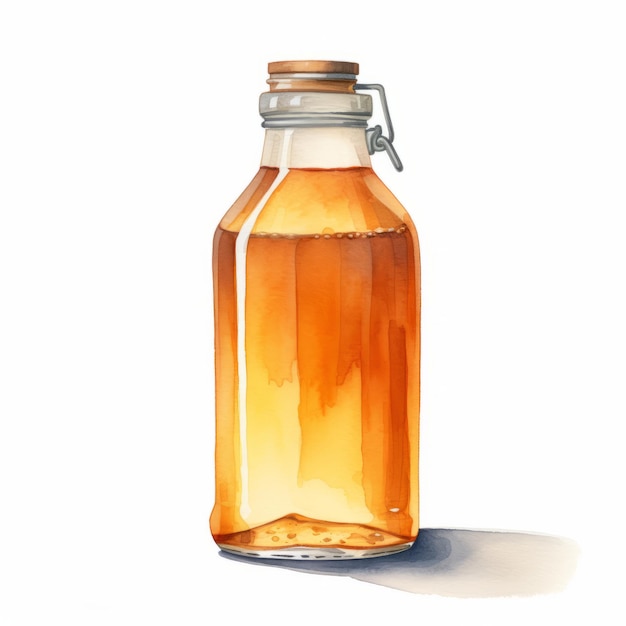
At what (x,y) coordinates should I click in order to perform the action: click on glass. Please return your answer as a coordinate pair (x, y). Looking at the image, I should click on (x=305, y=279).